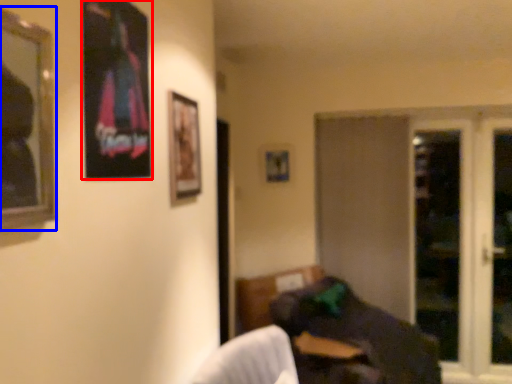
Question: Which point is further to the camera, picture frame (highlighted by a red box) or picture frame (highlighted by a blue box)?

Choices:
 (A) picture frame
 (B) picture frame

Answer: (A)